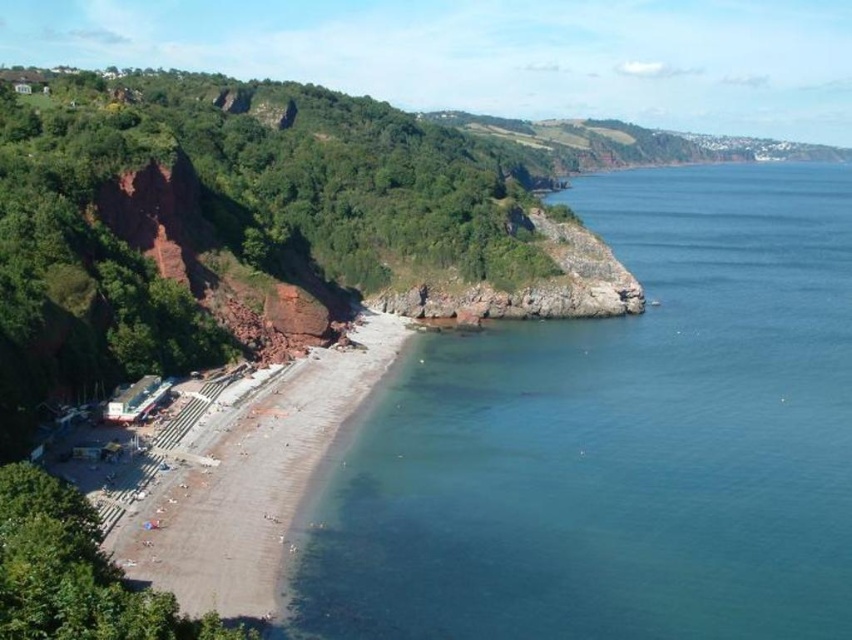
Question: Does clear blue water at lower left appear on the left side of brown sandy beach at lower left?

Choices:
 (A) yes
 (B) no

Answer: (B)

Question: Is clear blue water at lower left to the left of brown sandy beach at lower left from the viewer's perspective?

Choices:
 (A) no
 (B) yes

Answer: (A)

Question: Is clear blue water at lower left to the right of brown sandy beach at lower left from the viewer's perspective?

Choices:
 (A) yes
 (B) no

Answer: (A)

Question: Which point is farther from the camera taking this photo?

Choices:
 (A) (565, 403)
 (B) (210, 554)

Answer: (A)